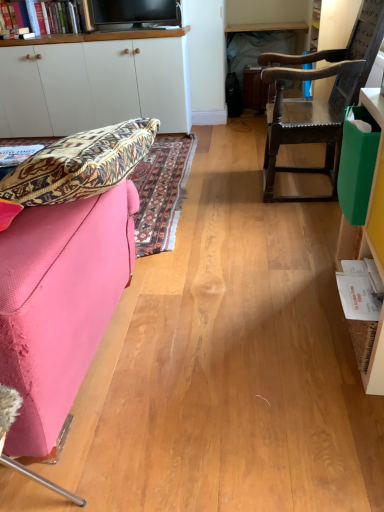
Question: Is dark brown wooden chair at right bigger than pink fabric couch at left?

Choices:
 (A) yes
 (B) no

Answer: (B)

Question: Can you confirm if dark brown wooden chair at right is positioned to the left of pink fabric couch at left?

Choices:
 (A) yes
 (B) no

Answer: (B)

Question: From the image's perspective, is dark brown wooden chair at right located beneath pink fabric couch at left?

Choices:
 (A) no
 (B) yes

Answer: (A)

Question: Is the position of dark brown wooden chair at right less distant than that of pink fabric couch at left?

Choices:
 (A) no
 (B) yes

Answer: (A)

Question: From a real-world perspective, is dark brown wooden chair at right located higher than pink fabric couch at left?

Choices:
 (A) yes
 (B) no

Answer: (A)

Question: Is there a large distance between dark brown wooden chair at right and pink fabric couch at left?

Choices:
 (A) yes
 (B) no

Answer: (A)

Question: Can dark brown wooden chair at right be found inside pink fabric couch at left?

Choices:
 (A) yes
 (B) no

Answer: (B)

Question: From a real-world perspective, does pink fabric couch at left sit lower than dark brown wooden chair at right?

Choices:
 (A) no
 (B) yes

Answer: (B)

Question: Considering the relative sizes of pink fabric couch at left and dark brown wooden chair at right in the image provided, is pink fabric couch at left bigger than dark brown wooden chair at right?

Choices:
 (A) yes
 (B) no

Answer: (A)

Question: From a real-world perspective, is pink fabric couch at left positioned over dark brown wooden chair at right based on gravity?

Choices:
 (A) no
 (B) yes

Answer: (A)

Question: From the image's perspective, is pink fabric couch at left located beneath dark brown wooden chair at right?

Choices:
 (A) no
 (B) yes

Answer: (B)

Question: Would you say pink fabric couch at left is outside dark brown wooden chair at right?

Choices:
 (A) yes
 (B) no

Answer: (A)

Question: Are matte paper book at left, placed as the second book when sorted from right to left, and black glossy tv at upper center far apart?

Choices:
 (A) yes
 (B) no

Answer: (A)